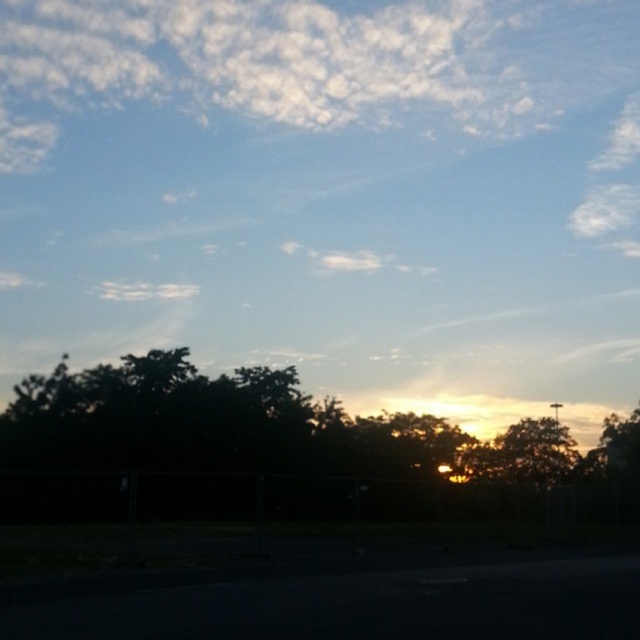
You are a hiker who wants to take a photo of the dark green leafy tree at center and the metallic silver street sign at lower right. Which object should you zoom in on to ensure both fit in the frame without moving the camera?

You should zoom in on the metallic silver street sign at lower right because the dark green leafy tree at center is wider than the metallic silver street sign at lower right, so zooming in on the narrower object allows both to fit in the frame.

You are a hiker who wants to take a photo of the dark green leafy tree at center and the metallic silver street sign at lower right. Based on their positions, which object should you focus on first if you want to capture both in a single frame without moving the camera?

The dark green leafy tree at center is positioned on the left side of the metallic silver street sign at lower right, so you should focus on the dark green leafy tree at center first to ensure both are in frame.

You are a hiker who wants to take a photo of both the dark green leafy tree at center and the metallic silver street sign at lower right in the same frame. Based on their sizes in the image, which object would appear larger in your photo?

The dark green leafy tree at center would appear larger in the photo because it is much taller than the metallic silver street sign at lower right.